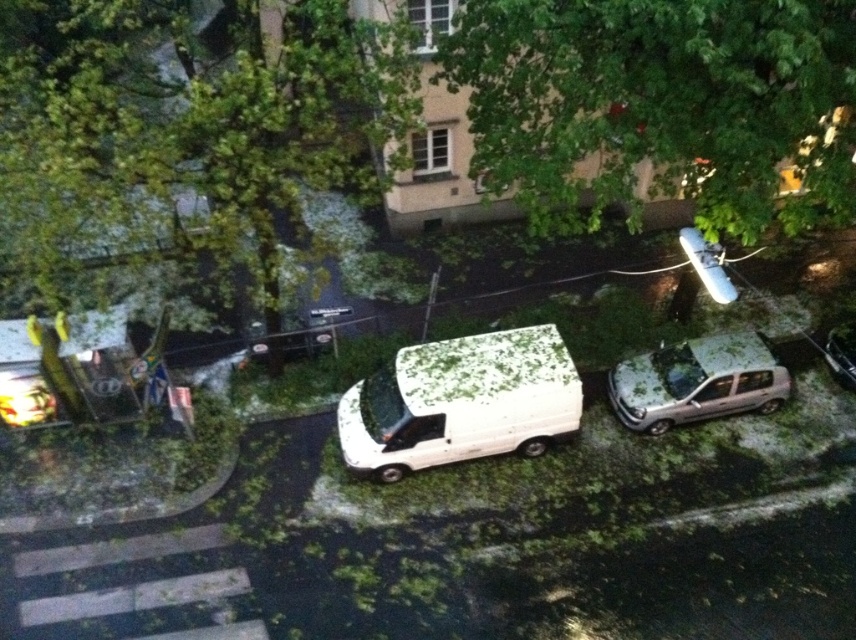
Does point (696, 38) come behind point (572, 419)?

No, (696, 38) is closer to viewer.

Does point (836, 113) come farther from viewer compared to point (399, 458)?

Yes, point (836, 113) is behind point (399, 458).

The image size is (856, 640). Find the location of `green leafy tree at upper center`. green leafy tree at upper center is located at coordinates (661, 106).

Does green leafy tree at upper left lie in front of white matte van at center?

Yes, it is.

Is green leafy tree at upper left further to the viewer compared to white matte van at center?

No, it is not.

You are a GUI agent. You are given a task and a screenshot of the screen. Output one action in this format:
    pyautogui.click(x=<x>, y=<y>)
    Task: Click on the green leafy tree at upper left
    
    Given the screenshot: What is the action you would take?
    pyautogui.click(x=188, y=131)

Locate an element on the screen. The width and height of the screenshot is (856, 640). green leafy tree at upper left is located at coordinates (188, 131).

Between point (343, 449) and point (657, 403), which one is positioned in front?

Point (343, 449) is more forward.

Can you confirm if white matte van at center is shorter than metallic silver minivan at center-right?

In fact, white matte van at center may be taller than metallic silver minivan at center-right.

Is point (453, 342) closer to camera compared to point (730, 396)?

Yes, it is.

Find the location of `white matte van at center`. white matte van at center is located at coordinates (461, 401).